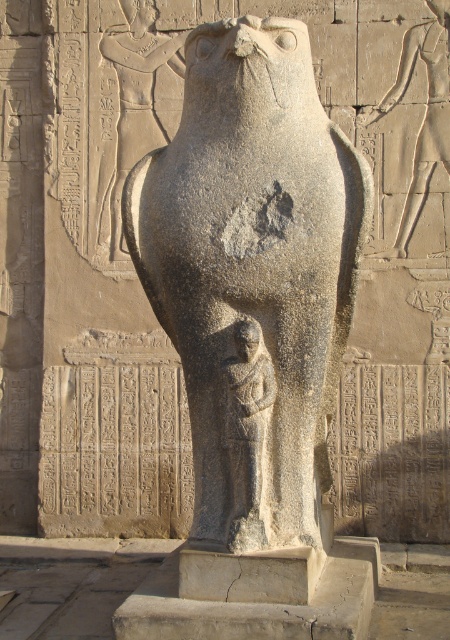
Question: Is gray stone bird at center bigger than gray stone figure at center?

Choices:
 (A) yes
 (B) no

Answer: (A)

Question: Which point is farther to the camera?

Choices:
 (A) gray stone figure at center
 (B) gray stone bird at center

Answer: (B)

Question: Is gray stone bird at center positioned in front of gray stone figure at center?

Choices:
 (A) yes
 (B) no

Answer: (B)

Question: Among these objects, which one is nearest to the camera?

Choices:
 (A) gray stone bird at center
 (B) gray stone figure at center

Answer: (B)

Question: Can you confirm if gray stone bird at center is positioned below gray stone figure at center?

Choices:
 (A) yes
 (B) no

Answer: (B)